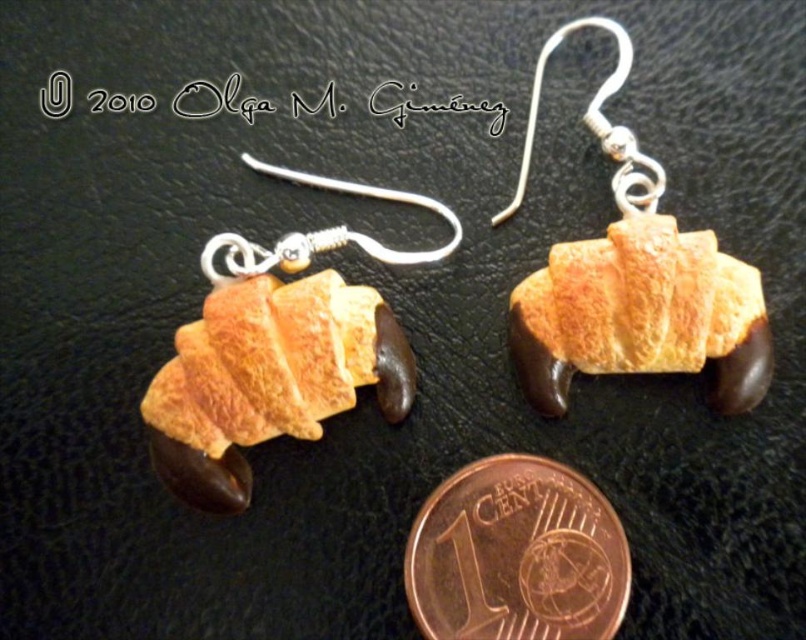
Question: Considering the real-world distances, which object is farthest from the golden matte croissant at center?

Choices:
 (A) copper metallic coin at lower center
 (B) silver/textured hook at upper left

Answer: (B)

Question: Which point appears farthest from the camera in this image?

Choices:
 (A) (717, 269)
 (B) (580, 547)
 (C) (239, 250)

Answer: (C)

Question: Is golden matte croissant at center smaller than silver/textured hook at upper left?

Choices:
 (A) yes
 (B) no

Answer: (B)

Question: Does golden matte croissant at center have a larger size compared to copper metallic coin at lower center?

Choices:
 (A) yes
 (B) no

Answer: (A)

Question: Which object is the farthest from the copper metallic coin at lower center?

Choices:
 (A) silver/textured hook at upper left
 (B) golden matte croissant at center

Answer: (A)

Question: Is golden matte croissant at center above copper metallic coin at lower center?

Choices:
 (A) no
 (B) yes

Answer: (B)